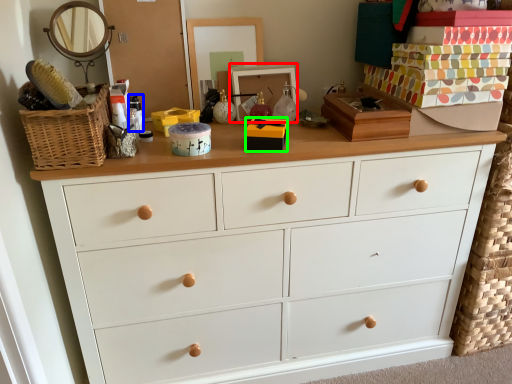
Question: Estimate the real-world distances between objects in this image. Which object is closer to picture frame (highlighted by a red box), toiletry (highlighted by a blue box) or box (highlighted by a green box)?

Choices:
 (A) toiletry
 (B) box

Answer: (B)